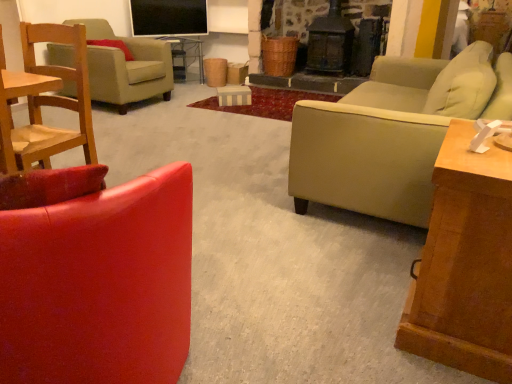
Question: Does matte red leather chair at left, arranged as the 3th chair when viewed from the back, come in front of suede-like beige pillow at upper left?

Choices:
 (A) no
 (B) yes

Answer: (B)

Question: Does matte red leather chair at left, arranged as the 3th chair when viewed from the back, have a larger size compared to suede-like beige pillow at upper left?

Choices:
 (A) no
 (B) yes

Answer: (B)

Question: From a real-world perspective, is matte red leather chair at left, arranged as the 3th chair when viewed from the back, beneath suede-like beige pillow at upper left?

Choices:
 (A) yes
 (B) no

Answer: (A)

Question: Is matte red leather chair at left, the 3th chair in the top-to-bottom sequence, wider than suede-like beige pillow at upper left?

Choices:
 (A) yes
 (B) no

Answer: (A)

Question: Is matte red leather chair at left, the 1th chair from the bottom, oriented towards suede-like beige pillow at upper left?

Choices:
 (A) yes
 (B) no

Answer: (A)

Question: Is point (175, 69) closer or farther from the camera than point (479, 243)?

Choices:
 (A) closer
 (B) farther

Answer: (B)

Question: From a real-world perspective, is matte wood side table at center physically located above or below wooden side table at right?

Choices:
 (A) below
 (B) above

Answer: (A)

Question: Is matte wood side table at center to the left or to the right of wooden side table at right in the image?

Choices:
 (A) right
 (B) left

Answer: (B)

Question: In terms of height, does matte wood side table at center look taller or shorter compared to wooden side table at right?

Choices:
 (A) tall
 (B) short

Answer: (B)

Question: Is matte red leather chair at left, which is counted as the 1th chair, starting from the front, taller or shorter than suede-like beige pillow at upper left?

Choices:
 (A) tall
 (B) short

Answer: (A)

Question: From the image's perspective, is matte red leather chair at left, the 1th chair from the bottom, located above or below suede-like beige pillow at upper left?

Choices:
 (A) below
 (B) above

Answer: (A)

Question: From a real-world perspective, relative to suede-like beige pillow at upper left, is matte red leather chair at left, arranged as the 3th chair when viewed from the back, vertically above or below?

Choices:
 (A) below
 (B) above

Answer: (A)

Question: Considering the positions of matte red leather chair at left, the 3th chair in the top-to-bottom sequence, and suede-like beige pillow at upper left in the image, is matte red leather chair at left, the 3th chair in the top-to-bottom sequence, wider or thinner than suede-like beige pillow at upper left?

Choices:
 (A) wide
 (B) thin

Answer: (A)

Question: Is velvet red armchair at left, which appears as the 2th chair when viewed from the top, wider or thinner than matte wood side table at center?

Choices:
 (A) wide
 (B) thin

Answer: (A)

Question: Considering the positions of velvet red armchair at left, the 2th chair viewed from the back, and matte wood side table at center in the image, is velvet red armchair at left, the 2th chair viewed from the back, bigger or smaller than matte wood side table at center?

Choices:
 (A) small
 (B) big

Answer: (B)